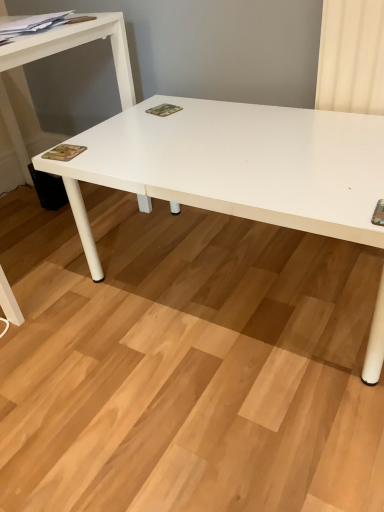
Locate an element on the screen. vacant location below white matte table at left (from a real-world perspective) is located at coordinates (32, 242).